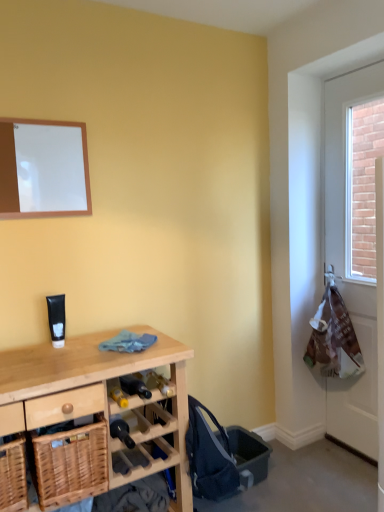
Question: From a real-world perspective, is wooden desk at lower left on top of woven wood basket at lower left, which ranks as the 2th basket in left-to-right order?

Choices:
 (A) yes
 (B) no

Answer: (B)

Question: From a real-world perspective, does wooden desk at lower left sit lower than woven wood basket at lower left, which ranks as the first basket in right-to-left order?

Choices:
 (A) no
 (B) yes

Answer: (B)

Question: Is wooden desk at lower left far away from woven wood basket at lower left, which ranks as the first basket in right-to-left order?

Choices:
 (A) yes
 (B) no

Answer: (B)

Question: From the image's perspective, is wooden desk at lower left on top of woven wood basket at lower left, which ranks as the 2th basket in left-to-right order?

Choices:
 (A) yes
 (B) no

Answer: (B)

Question: Does wooden desk at lower left lie in front of woven wood basket at lower left, which ranks as the first basket in right-to-left order?

Choices:
 (A) no
 (B) yes

Answer: (B)

Question: From a real-world perspective, is white plastic bag at right positioned above or below white matte board at upper left?

Choices:
 (A) above
 (B) below

Answer: (B)

Question: In terms of height, does white plastic bag at right look taller or shorter compared to white matte board at upper left?

Choices:
 (A) tall
 (B) short

Answer: (A)

Question: Considering the positions of white plastic bag at right and white matte board at upper left in the image, is white plastic bag at right wider or thinner than white matte board at upper left?

Choices:
 (A) thin
 (B) wide

Answer: (B)

Question: In the image, is white plastic bag at right on the left side or the right side of white matte board at upper left?

Choices:
 (A) left
 (B) right

Answer: (B)

Question: From a real-world perspective, is white matte board at upper left physically located above or below white plastic bag at right?

Choices:
 (A) below
 (B) above

Answer: (B)

Question: Considering the positions of white matte board at upper left and white plastic bag at right in the image, is white matte board at upper left wider or thinner than white plastic bag at right?

Choices:
 (A) thin
 (B) wide

Answer: (A)

Question: In terms of height, does white matte board at upper left look taller or shorter compared to white plastic bag at right?

Choices:
 (A) tall
 (B) short

Answer: (B)

Question: Considering the positions of point (18, 156) and point (329, 420), is point (18, 156) closer or farther from the camera than point (329, 420)?

Choices:
 (A) closer
 (B) farther

Answer: (A)

Question: Is white matte board at upper left bigger or smaller than wooden desk at lower left?

Choices:
 (A) big
 (B) small

Answer: (B)

Question: Would you say white matte board at upper left is inside or outside wooden desk at lower left?

Choices:
 (A) inside
 (B) outside

Answer: (B)